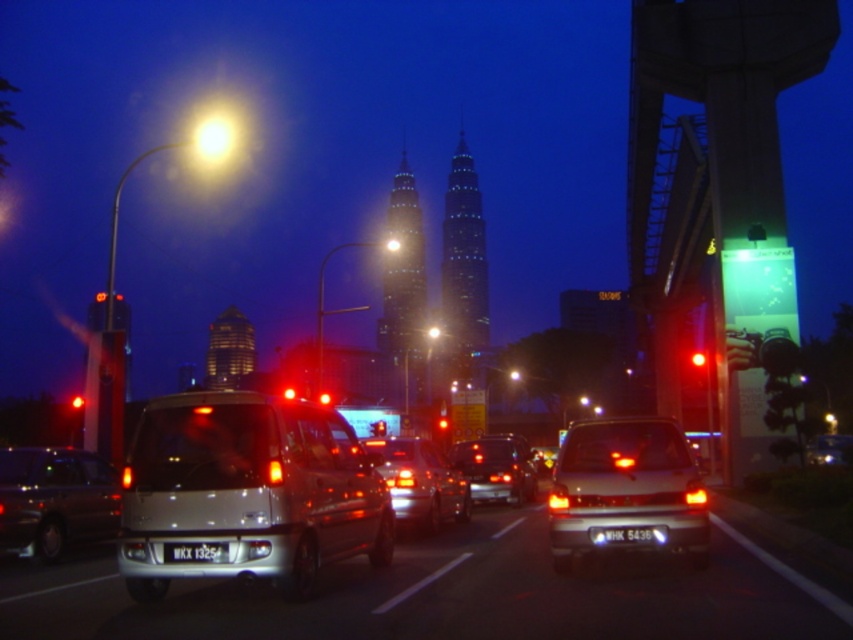
Does point (198, 556) lie in front of point (398, 248)?

Yes, point (198, 556) is in front of point (398, 248).

Does black plastic license plate at center have a greater width compared to bright yellow streetlight at upper center?

No.

Does point (167, 541) come behind point (395, 250)?

No, it is not.

Locate an element on the screen. The width and height of the screenshot is (853, 640). black plastic license plate at center is located at coordinates (195, 552).

Who is lower down, shiny silver sedan at center or white plastic license plate at center?

shiny silver sedan at center is below.

Does point (509, 486) come behind point (613, 531)?

Yes.

At what (x,y) coordinates should I click in order to perform the action: click on shiny silver sedan at center. Please return your answer as a coordinate pair (x, y). The height and width of the screenshot is (640, 853). Looking at the image, I should click on (496, 468).

Between point (161, 476) and point (570, 493), which one is positioned in front?

Point (161, 476) is in front.

Between silver metallic van at center and metallic silver sedan at center, which one is positioned higher?

silver metallic van at center

Which is in front, point (299, 568) or point (572, 566)?

Point (299, 568) is in front.

Find the location of a particular element. This screenshot has width=853, height=640. silver metallic van at center is located at coordinates (247, 492).